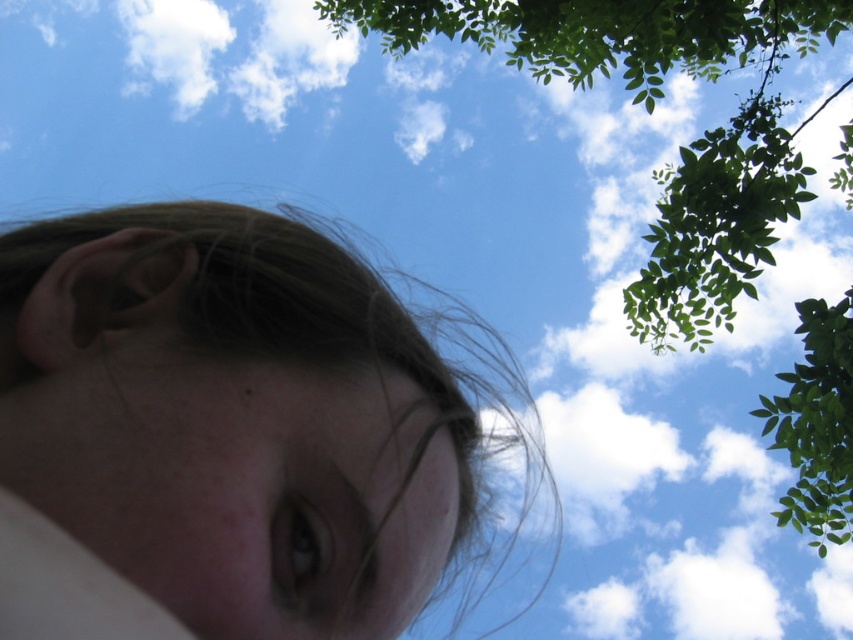
Consider the image. What are the coordinates of the smooth skin face at center?

The smooth skin face at center is located at coordinates point (247,412).

Consider the image. You are a photographer trying to capture the subject in the image. You want to ensure the smooth skin eye at center and the green leafy tree at upper right are both visible in the frame. Based on their positions, which object is closer to the left edge of the photo?

The smooth skin eye at center is positioned on the left side of green leafy tree at upper right, so it is closer to the left edge of the photo.

In the scene shown: Based on the scene description, where is the smooth skin eye at center located in terms of coordinates?

The smooth skin eye at center is located at coordinates point (248, 486).